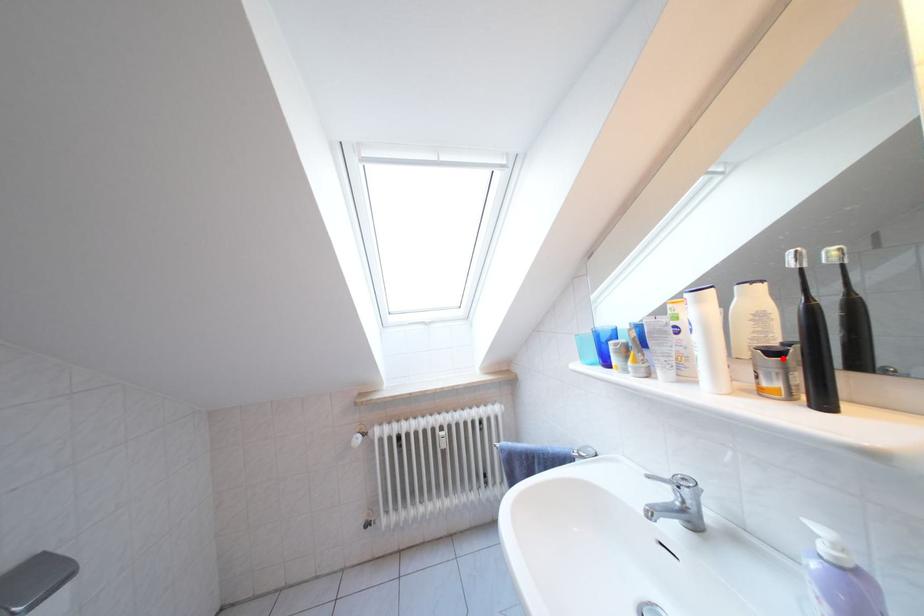
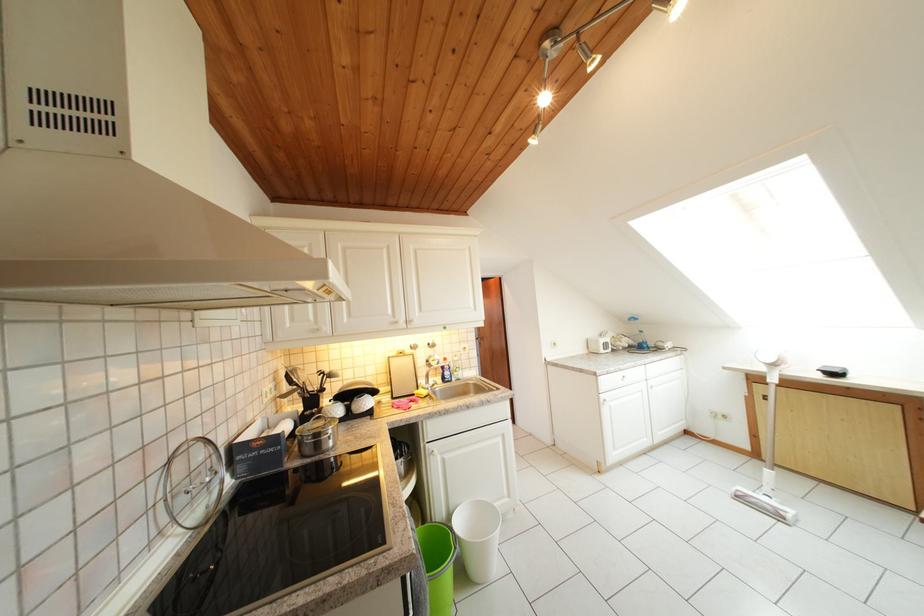
Question: I am providing you with two images of the same scene from different viewpoints. A red point is marked on the first image. Is the red point's position out of view in image 2?

Choices:
 (A) Yes
 (B) No

Answer: (A)